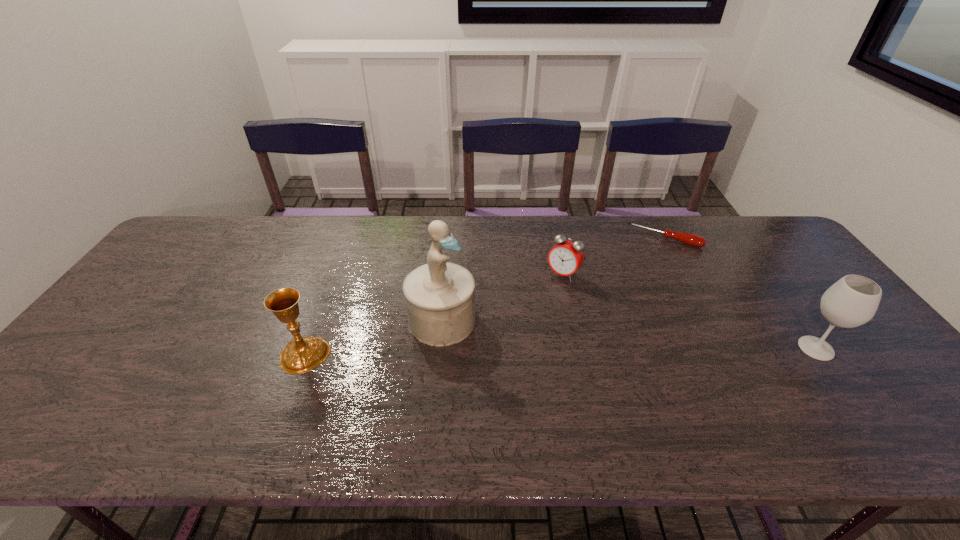
Image resolution: width=960 pixels, height=540 pixels. Identify the location of the leftmost object. (302, 354).

Locate an element on the screen. The width and height of the screenshot is (960, 540). wineglass is located at coordinates (852, 301).

You are a GUI agent. You are given a task and a screenshot of the screen. Output one action in this format:
    pyautogui.click(x=<x>, y=<y>)
    Task: Click on the fourth object from right to left
    The width and height of the screenshot is (960, 540).
    Given the screenshot: What is the action you would take?
    pyautogui.click(x=440, y=296)

Identify the location of the tallest object. The width and height of the screenshot is (960, 540). (440, 296).

Find the location of a particular element. Image resolution: width=960 pixels, height=540 pixels. the third object from left to right is located at coordinates (566, 257).

I want to click on the fourth tallest object, so click(x=566, y=257).

Locate an element on the screen. the farthest object is located at coordinates (693, 240).

The width and height of the screenshot is (960, 540). Identify the location of the shortest object. (693, 240).

Identify the location of vacant space located on the left of the leftmost object. (255, 354).

Locate an element on the screen. The height and width of the screenshot is (540, 960). vacant space located 0.070m on the left of the wineglass is located at coordinates (768, 348).